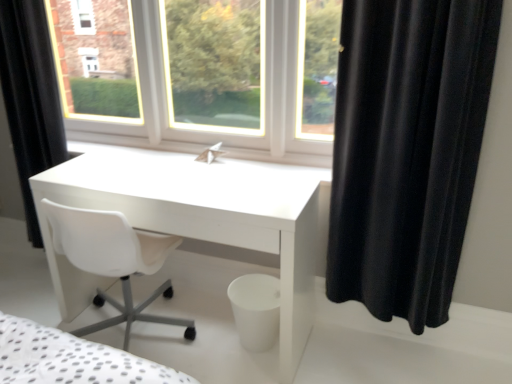
Question: Visually, is black velvet curtain at right, marked as the 1th curtain in a front-to-back arrangement, positioned to the left or to the right of black matte curtain at left, the 1th curtain from the back?

Choices:
 (A) right
 (B) left

Answer: (A)

Question: Does point (358, 157) appear closer or farther from the camera than point (15, 84)?

Choices:
 (A) farther
 (B) closer

Answer: (B)

Question: Which object is positioned farthest from the black matte curtain at left, which ranks as the 2th curtain in right-to-left order?

Choices:
 (A) white glossy desk at center
 (B) black velvet curtain at right, which is counted as the second curtain, starting from the back

Answer: (B)

Question: Based on their relative distances, which object is nearer to the black velvet curtain at right, the 1th curtain from the right?

Choices:
 (A) white glossy desk at center
 (B) black matte curtain at left, the 1th curtain in the left-to-right sequence

Answer: (A)